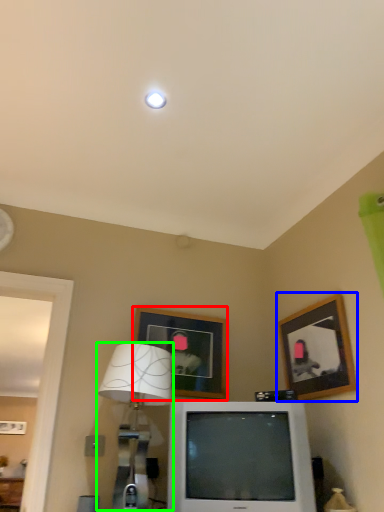
Question: Which object is the farthest from picture frame (highlighted by a red box)? Choose among these: picture frame (highlighted by a blue box) or table lamp (highlighted by a green box).

Choices:
 (A) picture frame
 (B) table lamp

Answer: (A)